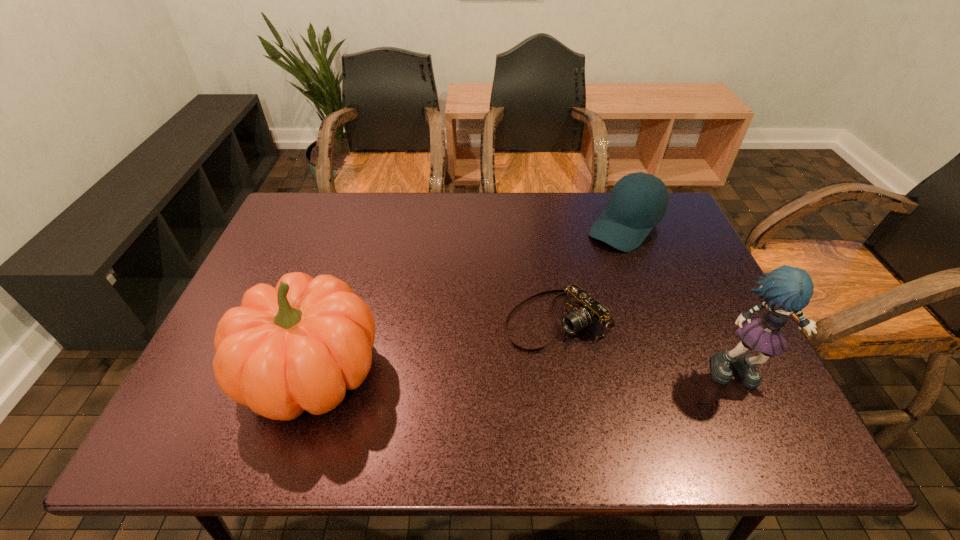
At what (x,y) coordinates should I click in order to perform the action: click on vacant point located on the front-facing side of the baseball cap. Please return your answer as a coordinate pair (x, y). This screenshot has width=960, height=540. Looking at the image, I should click on (578, 273).

The width and height of the screenshot is (960, 540). I want to click on vacant area situated 0.260m on the front-facing side of the baseball cap, so click(x=555, y=294).

Image resolution: width=960 pixels, height=540 pixels. What are the coordinates of `vacant space situated 0.230m on the front-facing side of the baseball cap` in the screenshot? It's located at (562, 288).

What are the coordinates of `object at the far edge` in the screenshot? It's located at (638, 201).

The width and height of the screenshot is (960, 540). Find the location of `pumpkin located at the near edge`. pumpkin located at the near edge is located at coordinates (299, 346).

Identify the location of rag doll positioned at the near edge. The height and width of the screenshot is (540, 960). (786, 290).

Where is `object present at the left edge`? This screenshot has height=540, width=960. object present at the left edge is located at coordinates (299, 346).

At what (x,y) coordinates should I click in order to perform the action: click on rag doll present at the right edge. Please return your answer as a coordinate pair (x, y). The image size is (960, 540). Looking at the image, I should click on click(x=786, y=290).

Find the location of `baseball cap at the right edge`. baseball cap at the right edge is located at coordinates (638, 201).

I want to click on object situated at the near left corner, so click(299, 346).